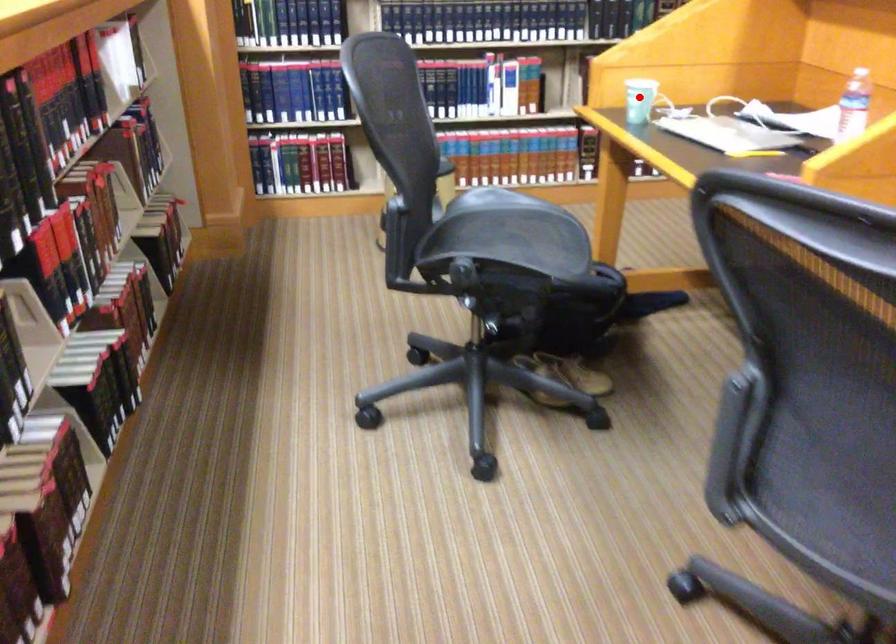
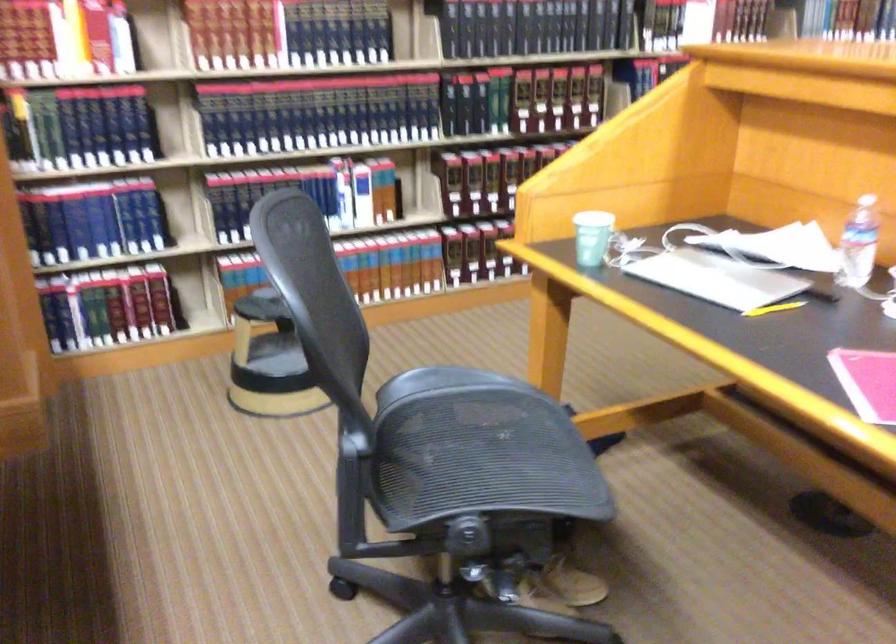
Locate, in the second image, the point that corresponds to the highlighted location in the first image.

(591, 237)